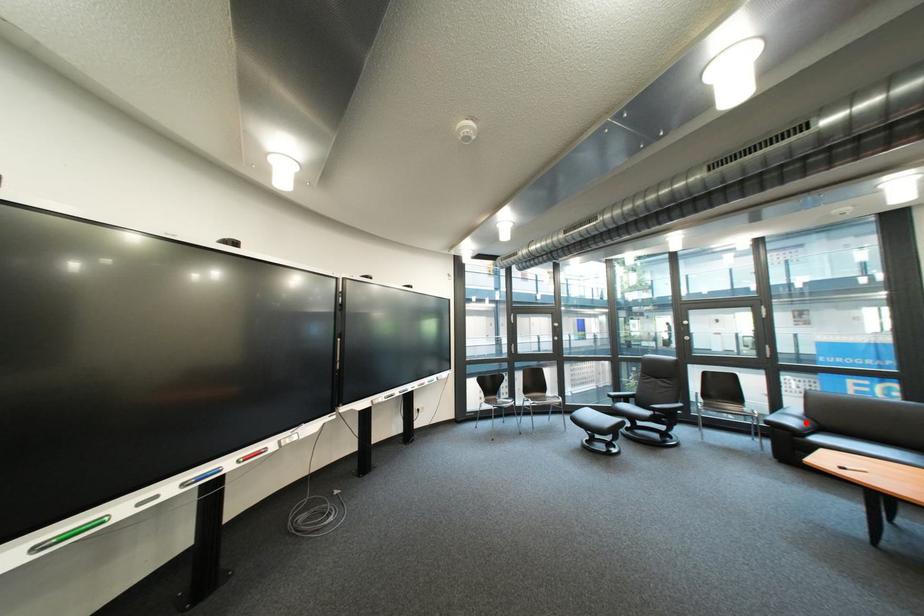
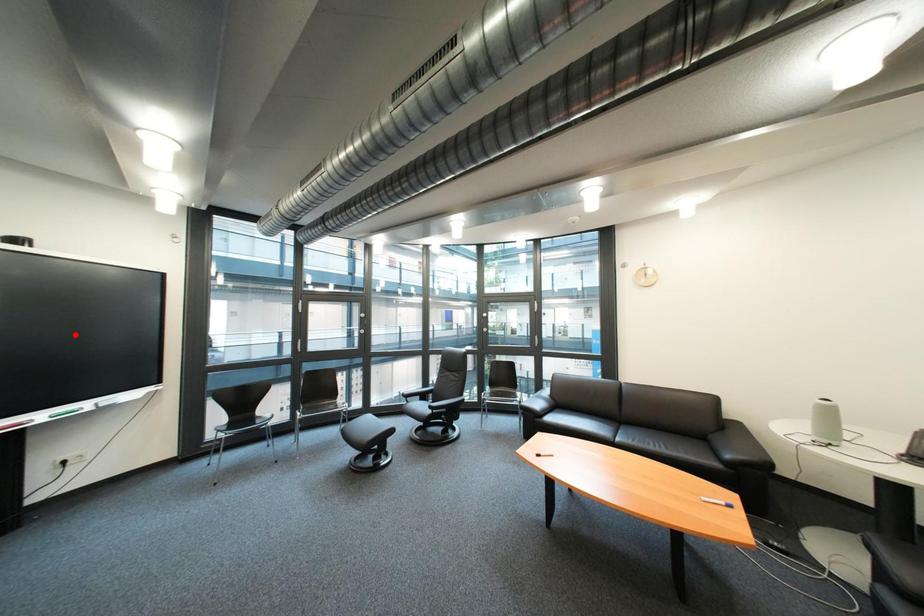
I am providing you with two images of the same scene from different viewpoints. A red point is marked on the first image and another point is marked on the second image. Does the point marked in image1 correspond to the same location as the one in image2?

No